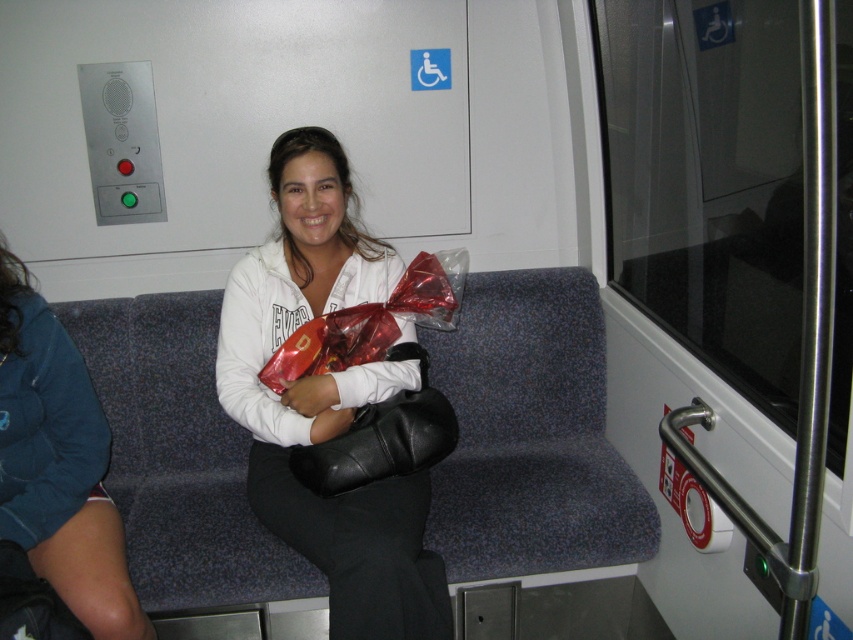
Looking at this image, who is shorter, white matte jacket at center or matte white hoodie at center?

With less height is matte white hoodie at center.

Is the position of white matte jacket at center more distant than that of matte white hoodie at center?

No, white matte jacket at center is closer to the viewer.

Does point (386, 376) come farther from viewer compared to point (19, 388)?

Yes, point (386, 376) is behind point (19, 388).

Image resolution: width=853 pixels, height=640 pixels. In order to click on white matte jacket at center in this screenshot , I will do `click(328, 401)`.

Based on the photo, does white matte jacket at center have a larger size compared to black leather bag at center?

Correct, white matte jacket at center is larger in size than black leather bag at center.

Who is positioned more to the right, white matte jacket at center or black leather bag at center?

black leather bag at center is more to the right.

Identify the location of white matte jacket at center. Image resolution: width=853 pixels, height=640 pixels. (328, 401).

Is matte white hoodie at center above black leather bag at center?

No, matte white hoodie at center is not above black leather bag at center.

Between matte white hoodie at center and black leather bag at center, which one has less height?

black leather bag at center

Between point (94, 636) and point (421, 401), which one is positioned in front?

Positioned in front is point (94, 636).

Locate an element on the screen. matte white hoodie at center is located at coordinates (57, 465).